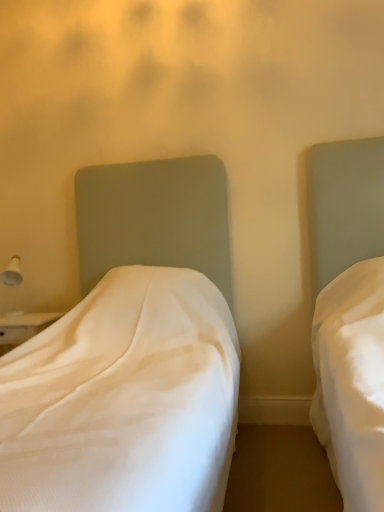
Question: In the image, is white fabric bed at left, which appears as the second bed when viewed from the right, positioned in front of or behind white glossy lampshade at left?

Choices:
 (A) behind
 (B) front

Answer: (B)

Question: In terms of size, does white fabric bed at left, which appears as the second bed when viewed from the right, appear bigger or smaller than white glossy lampshade at left?

Choices:
 (A) small
 (B) big

Answer: (B)

Question: Considering the real-world distances, which object is farthest from the white fabric bed at left, the 1th bed positioned from the left?

Choices:
 (A) white glossy lampshade at left
 (B) matte white bed at right, placed as the second bed when sorted from left to right

Answer: (A)

Question: Estimate the real-world distances between objects in this image. Which object is closer to the white glossy lampshade at left?

Choices:
 (A) matte white bed at right, acting as the first bed starting from the right
 (B) white fabric bed at left, the 1th bed positioned from the left

Answer: (B)